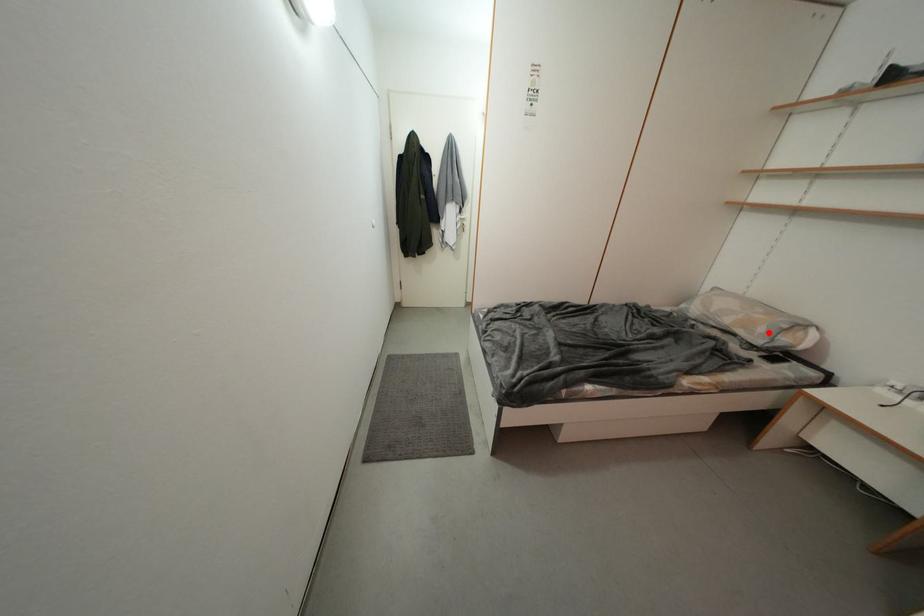
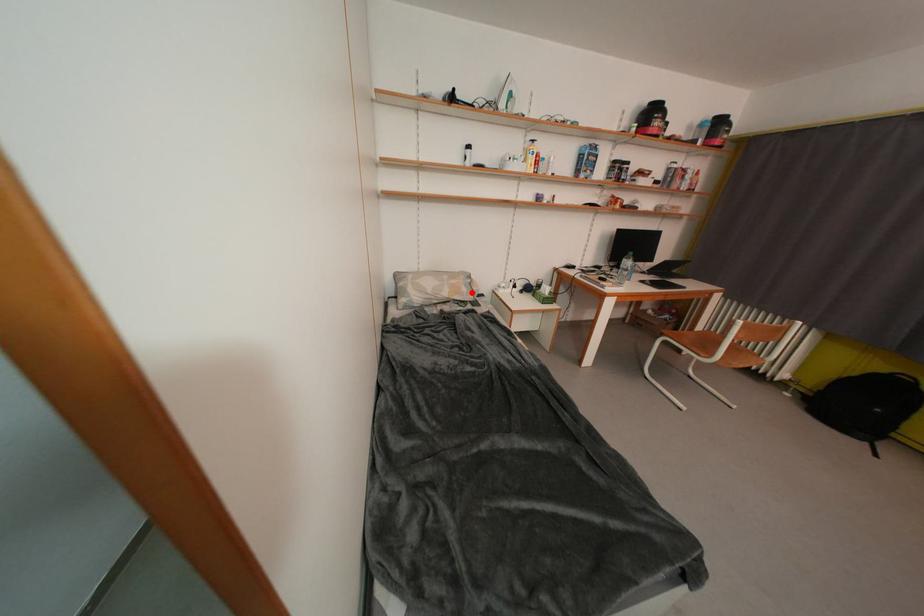
I am providing you with two images of the same scene from different viewpoints. A red point is marked on the first image and another point is marked on the second image. Is the marked point in image1 the same physical position as the marked point in image2?

Yes